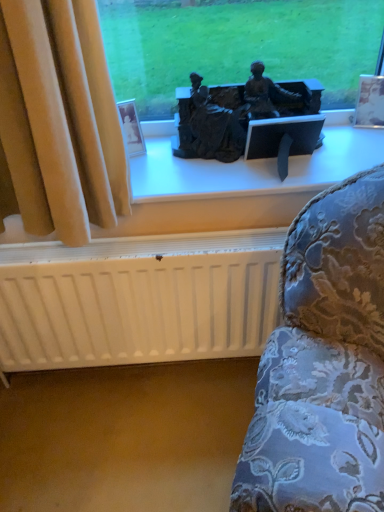
Describe the element at coordinates (253, 169) in the screenshot. I see `matte black statue at center` at that location.

Image resolution: width=384 pixels, height=512 pixels. What do you see at coordinates (237, 112) in the screenshot? I see `bronze statue at center` at bounding box center [237, 112].

The height and width of the screenshot is (512, 384). I want to click on white matte radiator at lower center, so click(138, 298).

How many degrees apart are the facing directions of bronze statue at center and white matte radiator at lower center?

The angular difference between bronze statue at center and white matte radiator at lower center is 0.414 degrees.

Is bronze statue at center completely or partially outside of white matte radiator at lower center?

Yes.

From the image's perspective, which one is positioned higher, bronze statue at center or white matte radiator at lower center?

bronze statue at center appears higher in the image.

Where is `sculpture positioned vertically above the white matte radiator at lower center (from a real-world perspective)`? sculpture positioned vertically above the white matte radiator at lower center (from a real-world perspective) is located at coordinates (237, 112).

Considering the sizes of objects bronze statue at center and matte black statue at center in the image provided, who is thinner, bronze statue at center or matte black statue at center?

Thinner between the two is bronze statue at center.

From a real-world perspective, which is physically above, bronze statue at center or matte black statue at center?

bronze statue at center.

Is bronze statue at center directly adjacent to matte black statue at center?

→ bronze statue at center is not next to matte black statue at center, and they're not touching.

Identify the location of window sill on the left of bronze statue at center. (253, 169).

Is matte black statue at center closer to the viewer compared to bronze statue at center?

That is False.

Which is more to the left, matte black statue at center or bronze statue at center?

Positioned to the left is matte black statue at center.

Locate an element on the screen. window sill lying behind the bronze statue at center is located at coordinates (253, 169).

From the picture: Can you confirm if matte black statue at center is taller than bronze statue at center?

No.

From the picture: How different are the orientations of white matte radiator at lower center and matte black statue at center in degrees?

The facing directions of white matte radiator at lower center and matte black statue at center are 0.231 degrees apart.

In the scene shown: Can you confirm if white matte radiator at lower center is wider than matte black statue at center?

No, white matte radiator at lower center is not wider than matte black statue at center.

From a real-world perspective, is white matte radiator at lower center over matte black statue at center?

No, from a real-world perspective, white matte radiator at lower center is not over matte black statue at center

From the picture: How distant is white matte radiator at lower center from matte black statue at center?

white matte radiator at lower center and matte black statue at center are 12.54 inches apart.

Locate an element on the screen. radiator directly beneath the bronze statue at center (from a real-world perspective) is located at coordinates (138, 298).

Consider the image. Measure the distance from white matte radiator at lower center to bronze statue at center.

white matte radiator at lower center is 19.47 inches from bronze statue at center.

Considering the points (261, 315) and (305, 98), which point is in front, point (261, 315) or point (305, 98)?

Point (305, 98)

Considering the positions of objects matte black statue at center and white matte radiator at lower center in the image provided, who is more to the left, matte black statue at center or white matte radiator at lower center?

Positioned to the left is white matte radiator at lower center.

Is matte black statue at center outside of white matte radiator at lower center?

Indeed, matte black statue at center is completely outside white matte radiator at lower center.

From a real-world perspective, which object rests below the other?

From a 3D spatial view, white matte radiator at lower center is below.

Find the location of a particular element. This screenshot has height=512, width=384. sculpture above the white matte radiator at lower center (from a real-world perspective) is located at coordinates (237, 112).

Find the location of a particular element. sculpture above the matte black statue at center (from the image's perspective) is located at coordinates (237, 112).

Considering their positions, is bronze statue at center positioned further to matte black statue at center than white matte radiator at lower center?

Among the two, white matte radiator at lower center is located further to matte black statue at center.

When comparing their distances from white matte radiator at lower center, does bronze statue at center or matte black statue at center seem closer?

matte black statue at center is closer to white matte radiator at lower center.

When comparing their distances from white matte radiator at lower center, does matte black statue at center or bronze statue at center seem further?

bronze statue at center is positioned further to the anchor white matte radiator at lower center.

Which object lies further to the anchor point bronze statue at center, matte black statue at center or white matte radiator at lower center?

white matte radiator at lower center is further to bronze statue at center.

From the image, which object appears to be nearer to matte black statue at center, white matte radiator at lower center or bronze statue at center?

The object closer to matte black statue at center is bronze statue at center.

In the scene shown: Estimate the real-world distances between objects in this image. Which object is closer to bronze statue at center, white matte radiator at lower center or matte black statue at center?

Among the two, matte black statue at center is located nearer to bronze statue at center.

You are a GUI agent. You are given a task and a screenshot of the screen. Output one action in this format:
    pyautogui.click(x=<x>, y=<y>)
    Task: Click on the window sill between bronze statue at center and white matte radiator at lower center in the up-down direction
    
    Given the screenshot: What is the action you would take?
    pyautogui.click(x=253, y=169)